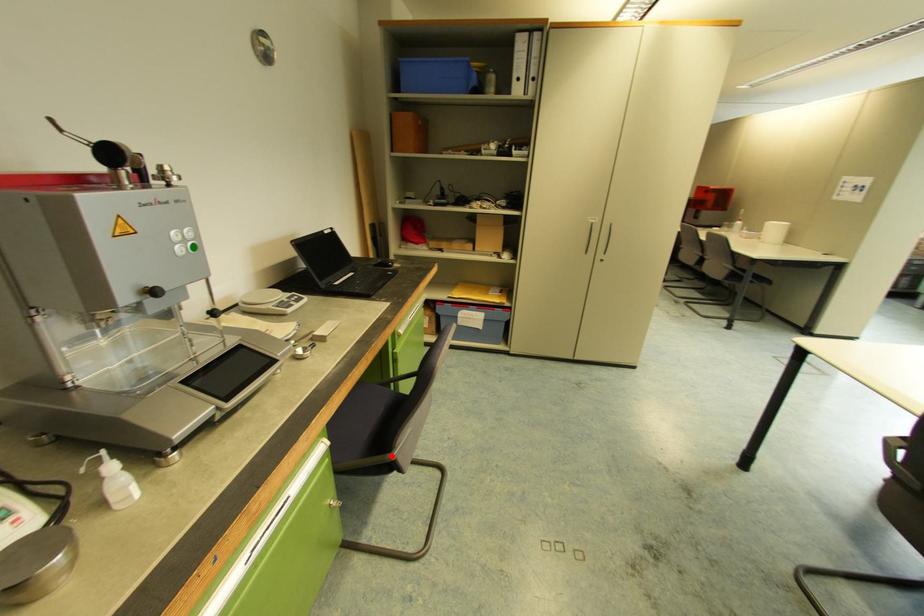
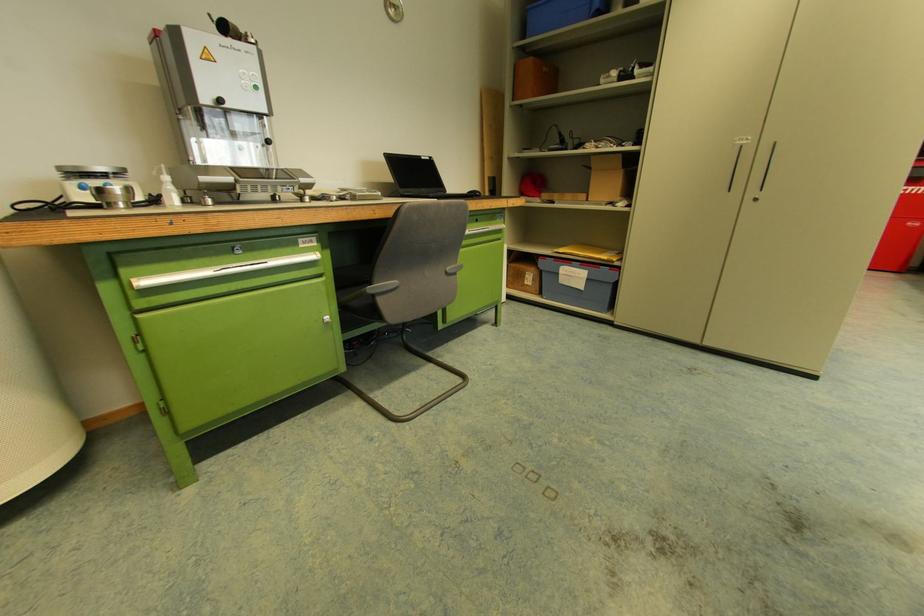
Question: I am providing you with two images of the same scene from different viewpoints. Given a red point in image1, look at the same physical point in image2. Is it:

Choices:
 (A) Closer to the viewpoint
 (B) Farther from the viewpoint

Answer: (A)